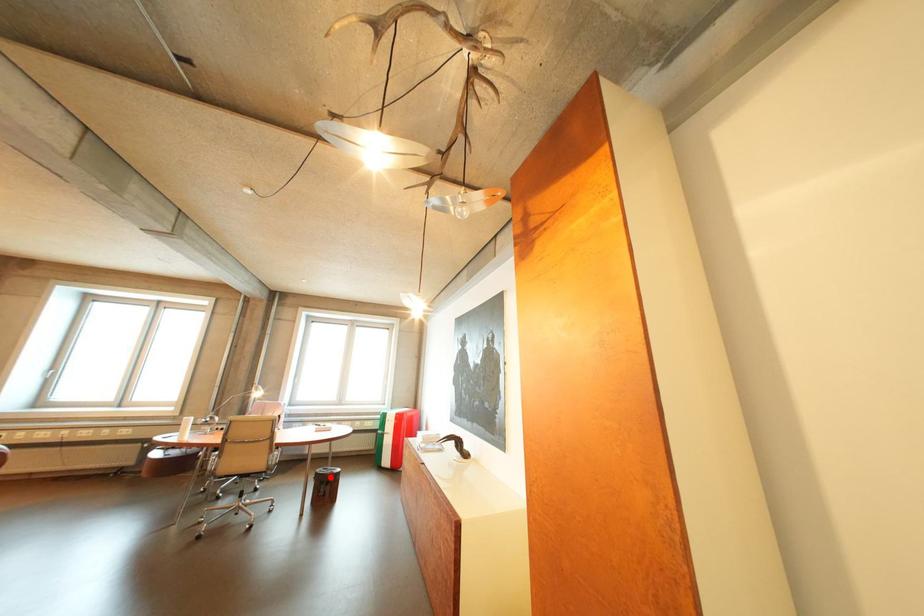
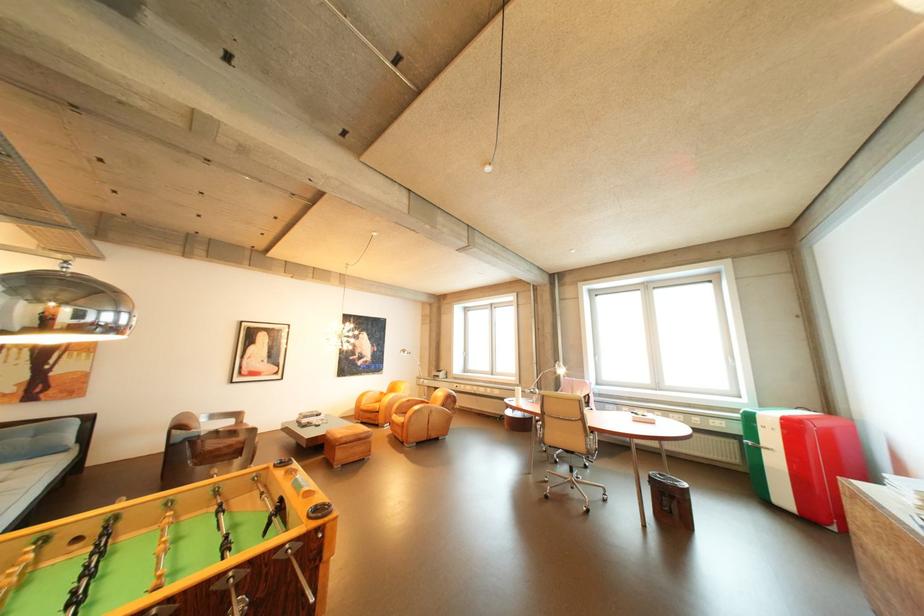
Question: I am providing you with two images of the same scene from different viewpoints. Image1 has a red point marked. In image2, the corresponding 3D location appears at what relative position? Reply with the corresponding letter.

Choices:
 (A) Closer
 (B) Farther

Answer: (B)